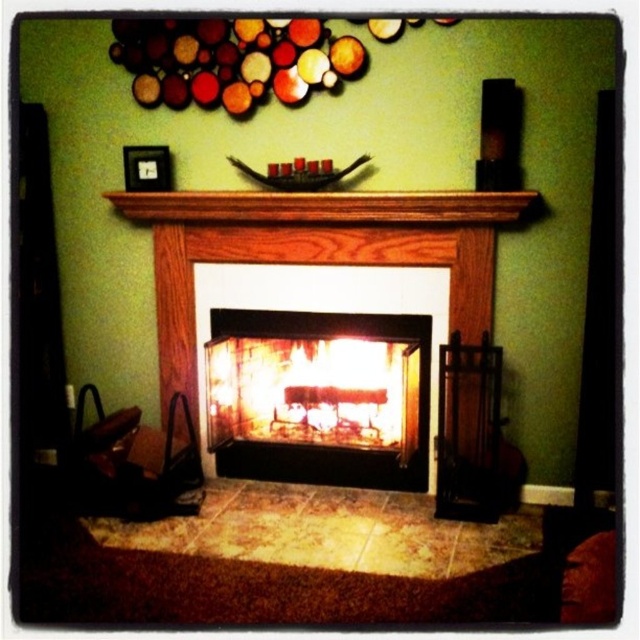
You are standing in the room and want to place a new painting exactly at the same position as the wooden fireplace at center. What coordinates should you aim for?

The wooden fireplace at center is located at coordinates point (x=314, y=250), so you should aim for those coordinates to place the new painting.

You are standing in the living room and see the flaming wood fire at center and the wooden mantel at center. Which object is located higher up in the image?

The wooden mantel at center is higher up because the flaming wood fire at center is below it.

You are standing in front of the fireplace and see two points marked in the image. The first point is at coordinate point [387,392] and the second is at point [256,211]. Which point is closer to you?

Point [256,211] is closer to you because it is in front of point [387,392].